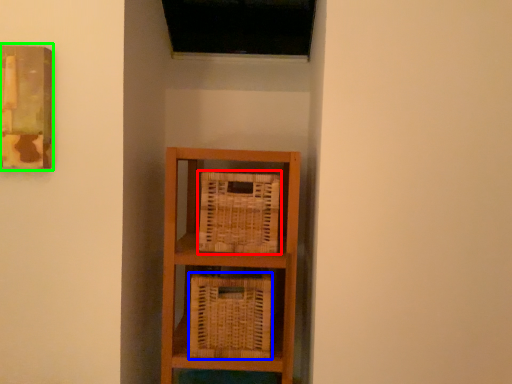
Question: Which object is the farthest from basket (highlighted by a red box)? Choose among these: basket (highlighted by a blue box) or picture frame (highlighted by a green box).

Choices:
 (A) basket
 (B) picture frame

Answer: (B)